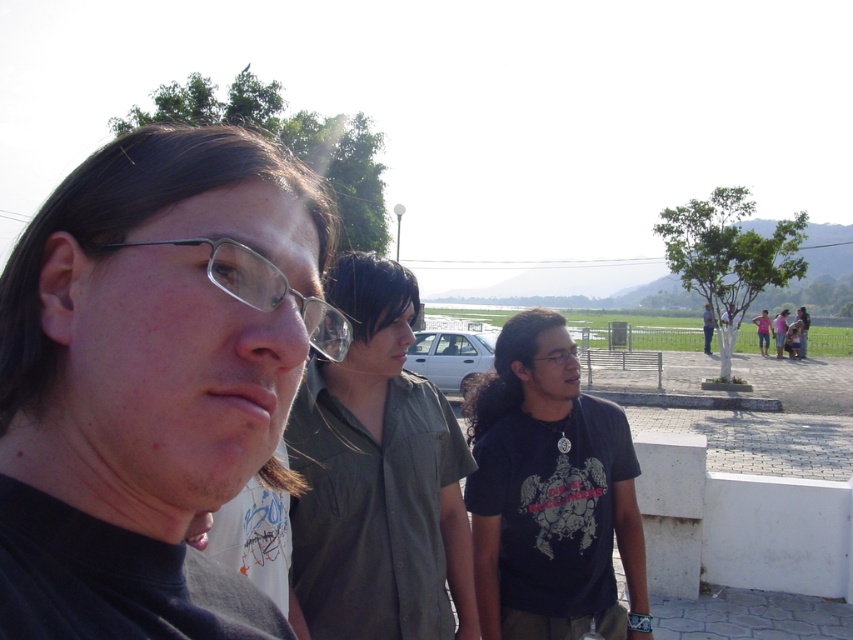
Question: Which point is closer to the camera?

Choices:
 (A) clear plastic glasses at center
 (B) green matte shirt at center

Answer: (A)

Question: Can you confirm if matte black shirt at center is positioned below green matte shirt at center?

Choices:
 (A) no
 (B) yes

Answer: (A)

Question: Is matte black shirt at center closer to camera compared to matte black glasses at center?

Choices:
 (A) yes
 (B) no

Answer: (A)

Question: Which object is farther from the camera taking this photo?

Choices:
 (A) clear plastic glasses at center
 (B) green matte shirt at center
 (C) dark blue t-shirt at center

Answer: (C)

Question: Which point is closer to the camera?

Choices:
 (A) (554, 353)
 (B) (325, 312)
 (C) (543, 413)

Answer: (B)

Question: Where is matte black shirt at center located in relation to matte black glasses at center in the image?

Choices:
 (A) below
 (B) above

Answer: (B)